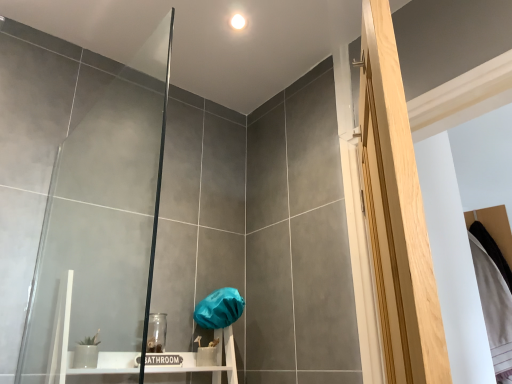
Where is `transparent glass door at left`? The width and height of the screenshot is (512, 384). transparent glass door at left is located at coordinates (100, 199).

The image size is (512, 384). What do you see at coordinates (100, 199) in the screenshot?
I see `transparent glass door at left` at bounding box center [100, 199].

This screenshot has height=384, width=512. I want to click on light wood screen door at right, so click(x=397, y=214).

This screenshot has width=512, height=384. Describe the element at coordinates (397, 214) in the screenshot. I see `light wood screen door at right` at that location.

Find the location of a particular element. The height and width of the screenshot is (384, 512). transparent glass door at left is located at coordinates (100, 199).

Considering the relative positions of light wood screen door at right and transparent glass door at left in the image provided, is light wood screen door at right to the right of transparent glass door at left from the viewer's perspective?

Yes, light wood screen door at right is to the right of transparent glass door at left.

Is the position of light wood screen door at right more distant than that of transparent glass door at left?

That is False.

Considering the positions of point (412, 331) and point (149, 170), is point (412, 331) closer or farther from the camera than point (149, 170)?

Clearly, point (412, 331) is closer to the camera than point (149, 170).

From the image's perspective, is light wood screen door at right below transparent glass door at left?

No, from the image's perspective, light wood screen door at right is not beneath transparent glass door at left.

From a real-world perspective, who is located lower, light wood screen door at right or transparent glass door at left?

transparent glass door at left is physically lower.

Is light wood screen door at right wider or thinner than transparent glass door at left?

In the image, light wood screen door at right appears to be more narrow than transparent glass door at left.

Considering the relative sizes of light wood screen door at right and transparent glass door at left in the image provided, is light wood screen door at right shorter than transparent glass door at left?

Incorrect, the height of light wood screen door at right does not fall short of that of transparent glass door at left.

Can you confirm if light wood screen door at right is smaller than transparent glass door at left?

Incorrect, light wood screen door at right is not smaller in size than transparent glass door at left.

Based on the photo, is light wood screen door at right not inside transparent glass door at left?

Absolutely, light wood screen door at right is external to transparent glass door at left.

Would you consider light wood screen door at right to be distant from transparent glass door at left?

That's right, there is a large distance between light wood screen door at right and transparent glass door at left.

Is transparent glass door at left at the back of light wood screen door at right?

That's right, light wood screen door at right is facing away from transparent glass door at left.

Identify the location of screen door that is in front of the transparent glass door at left. The height and width of the screenshot is (384, 512). (397, 214).

In the image, is transparent glass door at left on the left side or the right side of light wood screen door at right?

In the image, transparent glass door at left appears on the left side of light wood screen door at right.

Consider the image. Which object is closer to the camera, transparent glass door at left or light wood screen door at right?

Positioned in front is light wood screen door at right.

Between point (135, 346) and point (392, 136), which one is positioned behind?

Point (135, 346)

From the image's perspective, is transparent glass door at left on light wood screen door at right?

No, from the image's perspective, transparent glass door at left is not over light wood screen door at right.

From a real-world perspective, which object stands above the other?

In real-world perspective, light wood screen door at right is above.

Does transparent glass door at left have a lesser width compared to light wood screen door at right?

Incorrect, the width of transparent glass door at left is not less than that of light wood screen door at right.

Based on the photo, who is taller, transparent glass door at left or light wood screen door at right?

With more height is light wood screen door at right.

Consider the image. Can you confirm if transparent glass door at left is smaller than light wood screen door at right?

Indeed, transparent glass door at left has a smaller size compared to light wood screen door at right.

Would you say transparent glass door at left contains light wood screen door at right?

No, light wood screen door at right is not surrounded by transparent glass door at left.

Is transparent glass door at left far away from light wood screen door at right?

Yes, transparent glass door at left and light wood screen door at right are located far from each other.

Could you tell me if transparent glass door at left is facing light wood screen door at right?

No, transparent glass door at left is not facing towards light wood screen door at right.

Identify the location of screen door above the transparent glass door at left (from the image's perspective). The image size is (512, 384). (397, 214).

In order to click on screen door positioned vertically above the transparent glass door at left (from a real-world perspective) in this screenshot , I will do `click(397, 214)`.

This screenshot has width=512, height=384. I want to click on glass door below the light wood screen door at right (from a real-world perspective), so click(x=100, y=199).